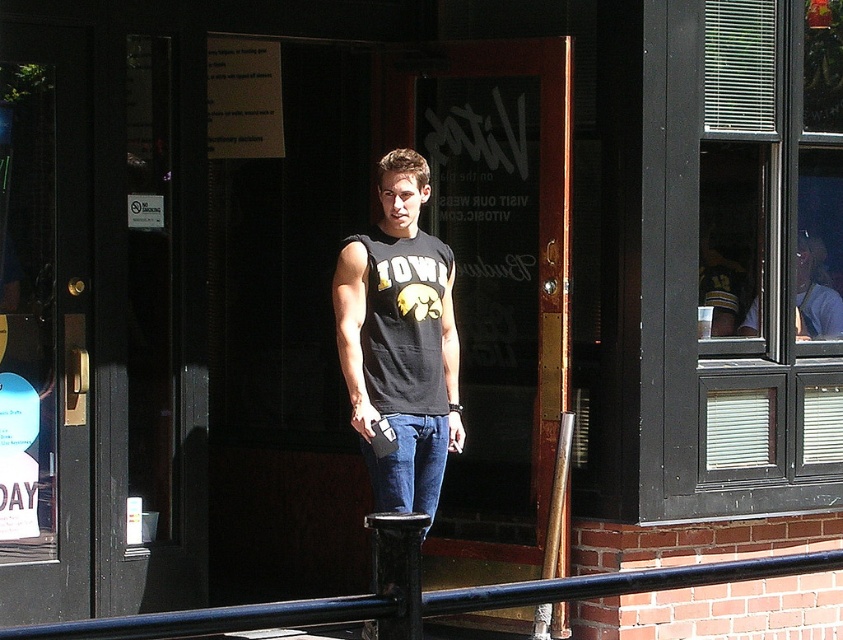
You are a fashion designer observing a man wearing a black matte tank top at center and jeans at center. Which clothing item is wider?

The black matte tank top at center is wider than the jeans at center.

You are a photographer trying to capture the man in the black matte tank top at center and the black metal rail at center in the same frame. Based on their positions, which object is closer to the left side of the image?

The black matte tank top at center is closer to the left side of the image because it is positioned to the left of the black metal rail at center.

Looking at this image, you are standing in front of the building and notice the black metal rail at center and jeans at center. Which object is nearer to you?

The black metal rail at center is closer to the viewer than jeans at center.